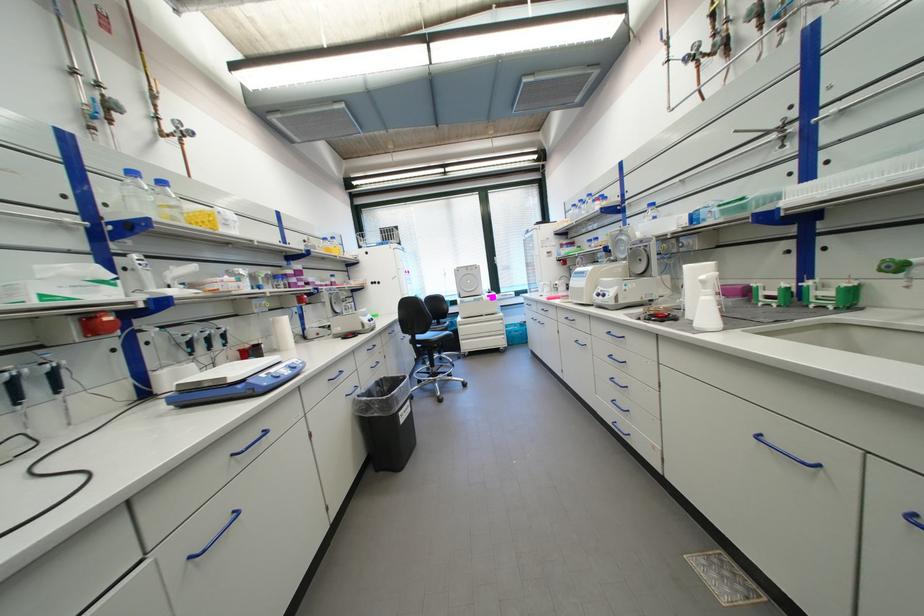
Where is `red valve handle`? Image resolution: width=924 pixels, height=616 pixels. red valve handle is located at coordinates (99, 325).